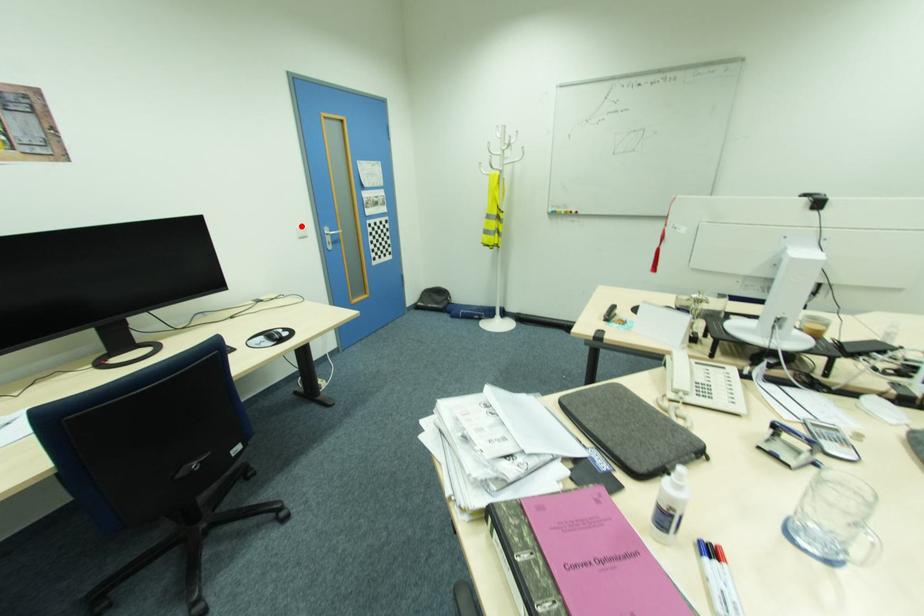
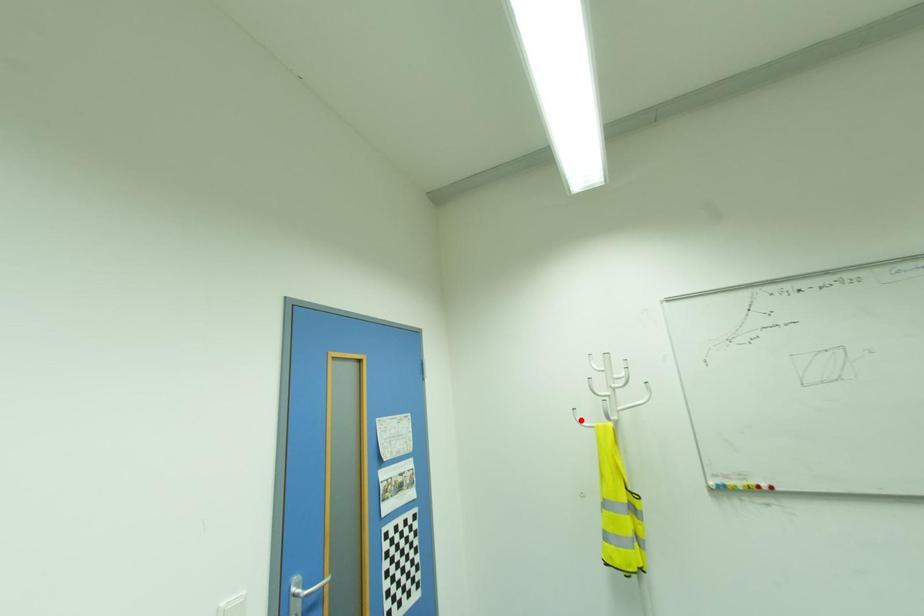
I am providing you with two images of the same scene from different viewpoints. A red point is marked on the first image and another point is marked on the second image. Do the highlighted points in image1 and image2 indicate the same real-world spot?

No